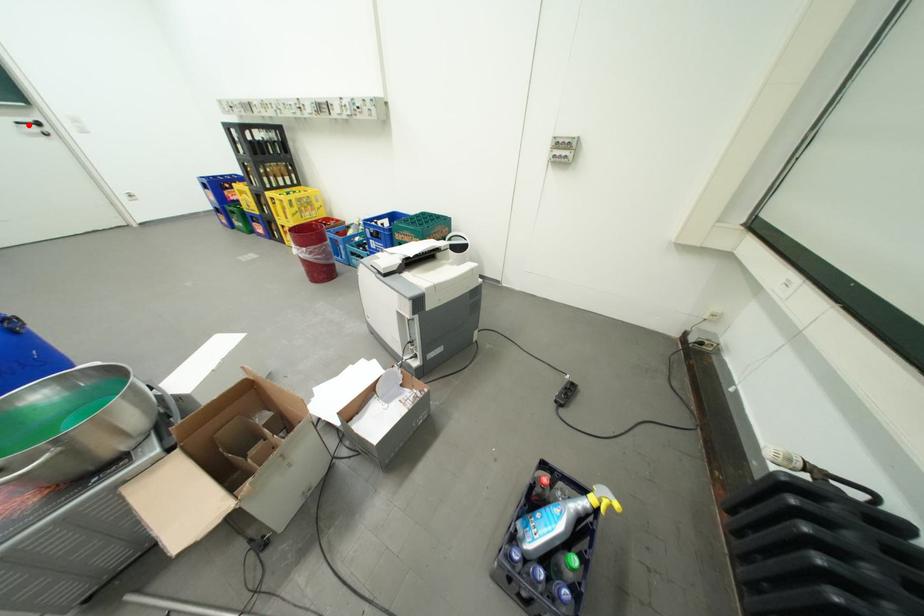
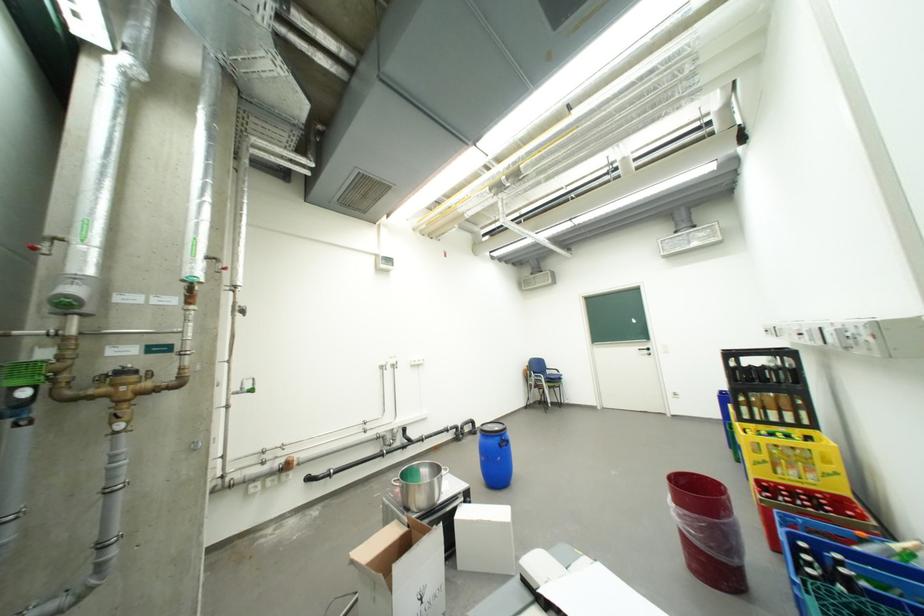
Question: I am providing you with two images of the same scene from different viewpoints. Given a red point in image1, look at the same physical point in image2. Is it:

Choices:
 (A) Closer to the viewpoint
 (B) Farther from the viewpoint

Answer: (A)